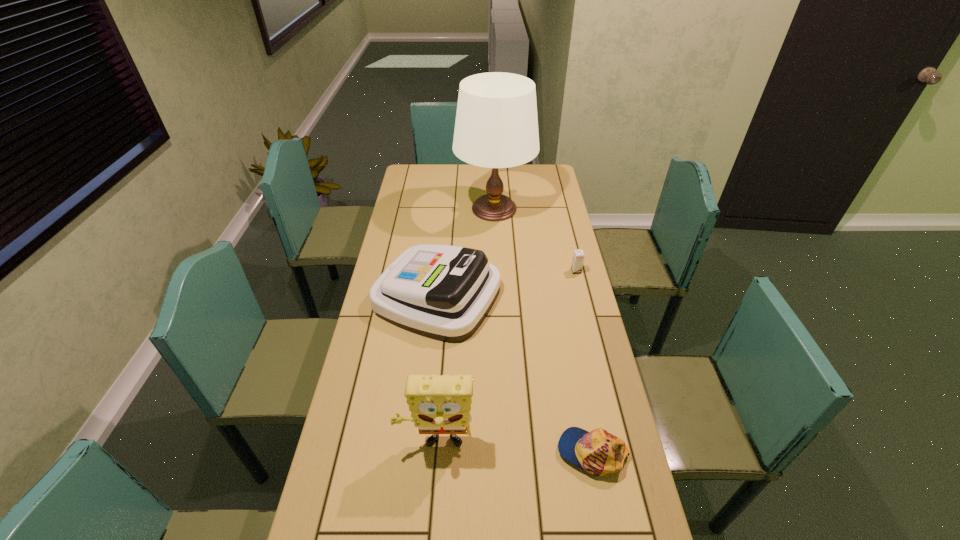
Identify the location of free point located 0.400m on the bill of the cap. The image size is (960, 540). (405, 452).

The image size is (960, 540). What are the coordinates of `free space located 0.310m on the bill of the cap` in the screenshot? It's located at (440, 452).

Identify the location of blank space located 0.340m on the bill of the cap. The height and width of the screenshot is (540, 960). (428, 452).

Locate an element on the screen. object located at the left edge is located at coordinates (442, 292).

At what (x,y) coordinates should I click in order to perform the action: click on lamp that is at the right edge. Please return your answer as a coordinate pair (x, y). This screenshot has height=540, width=960. Looking at the image, I should click on (496, 126).

Where is `chocolate milk positioned at the right edge`? chocolate milk positioned at the right edge is located at coordinates (578, 256).

At what (x,y) coordinates should I click in order to perform the action: click on cap positioned at the right edge. Please return your answer as a coordinate pair (x, y). The height and width of the screenshot is (540, 960). Looking at the image, I should click on (598, 452).

You are a GUI agent. You are given a task and a screenshot of the screen. Output one action in this format:
    pyautogui.click(x=<x>, y=<y>)
    Task: Click on the free space at the far edge
    The width and height of the screenshot is (960, 540).
    Given the screenshot: What is the action you would take?
    pyautogui.click(x=470, y=181)

You are a GUI agent. You are given a task and a screenshot of the screen. Output one action in this format:
    pyautogui.click(x=<x>, y=<y>)
    Task: Click on the blank space at the left edge
    This screenshot has width=960, height=540.
    Given the screenshot: What is the action you would take?
    click(416, 236)

In the image, there is a desktop. Where is `blank space at the right edge`? This screenshot has width=960, height=540. blank space at the right edge is located at coordinates (588, 474).